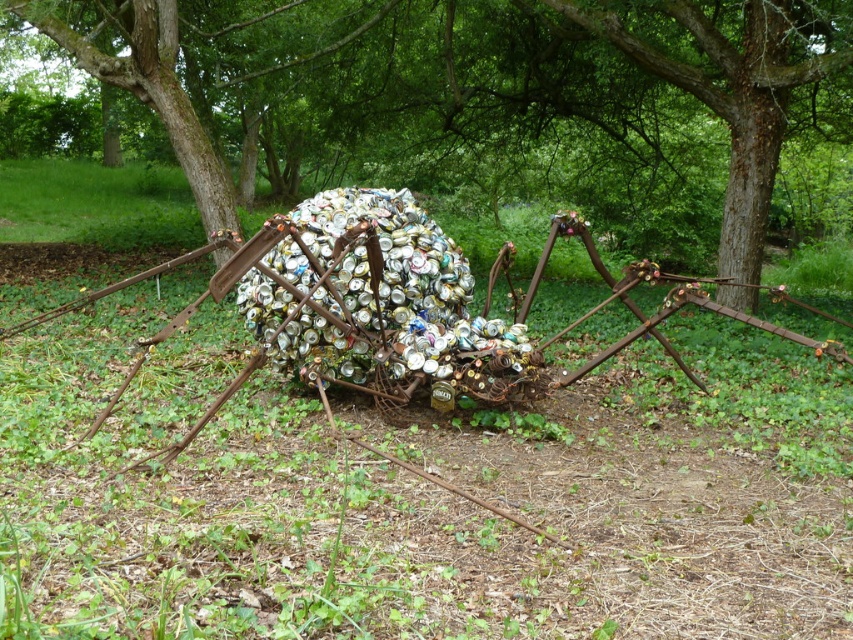
You are standing in the grassy area and see the brown wood tree at center and the rusty metal spider at center. Which object is positioned to the left of the other?

The brown wood tree at center is to the left of the rusty metal spider at center.